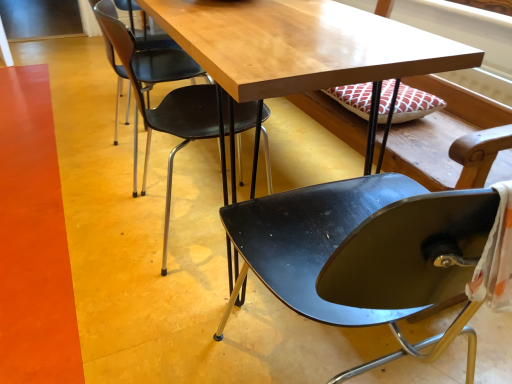
The height and width of the screenshot is (384, 512). I want to click on free point behind black plastic chair at upper center, acting as the 1th chair starting from the left, so [x=198, y=163].